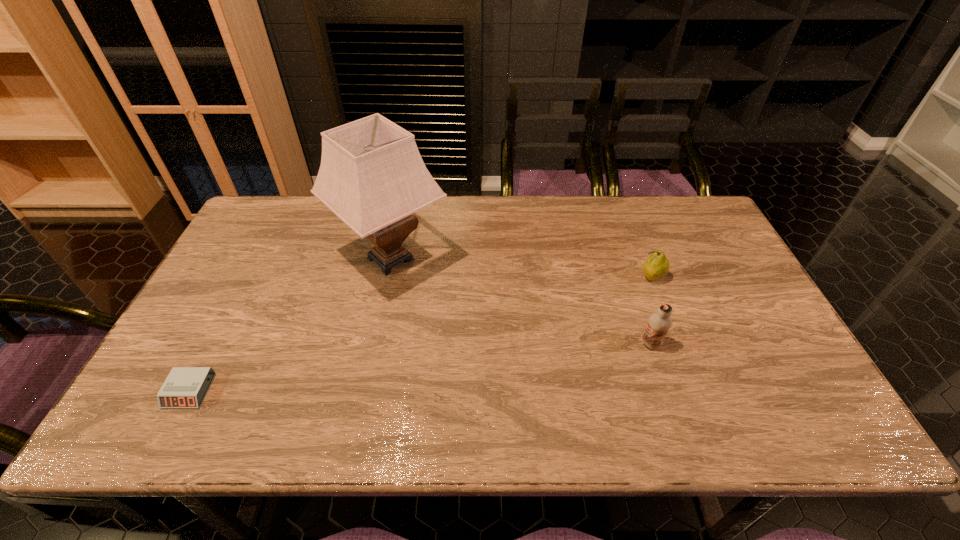
Identify the location of vacant space located 0.340m on the left of the second shortest object. This screenshot has width=960, height=540. (520, 277).

This screenshot has height=540, width=960. What are the coordinates of `blank space located 0.350m on the right of the nearest object` in the screenshot? It's located at (360, 391).

Find the location of a particular element. The image size is (960, 540). object that is at the far edge is located at coordinates pos(372,176).

At what (x,y) coordinates should I click in order to perform the action: click on object at the near edge. Please return your answer as a coordinate pair (x, y). The image size is (960, 540). Looking at the image, I should click on (185, 387).

Locate an element on the screen. object that is at the left edge is located at coordinates (185, 387).

Where is `object that is at the near left corner`? The width and height of the screenshot is (960, 540). object that is at the near left corner is located at coordinates (185, 387).

This screenshot has height=540, width=960. Find the location of `vacant space at the far edge of the desktop`. vacant space at the far edge of the desktop is located at coordinates (480, 217).

In the image, there is a desktop. Where is `vacant region at the near edge`? vacant region at the near edge is located at coordinates (602, 415).

The image size is (960, 540). In the image, there is a desktop. Find the location of `vacant space at the left edge`. vacant space at the left edge is located at coordinates (218, 272).

Locate an element on the screen. vacant region at the right edge of the desktop is located at coordinates (770, 345).